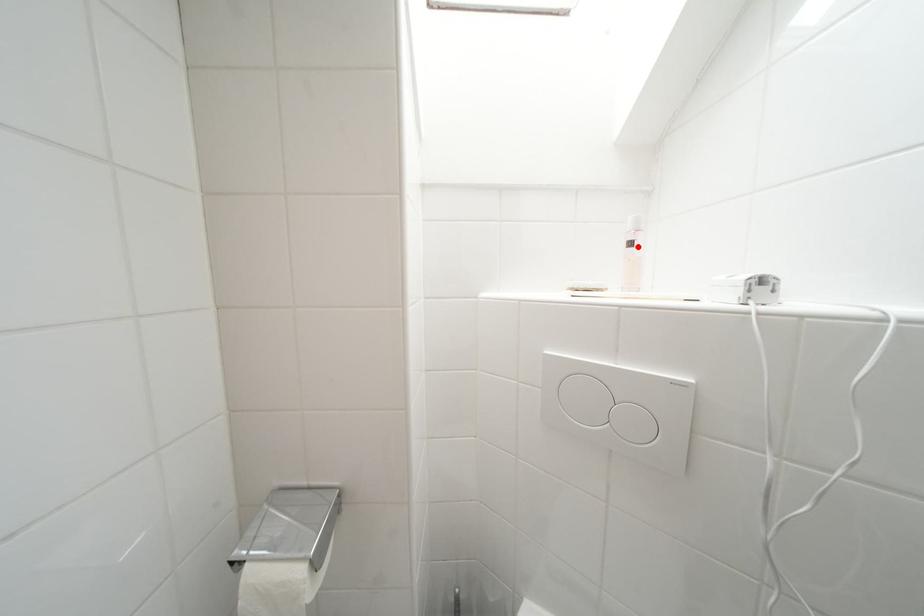
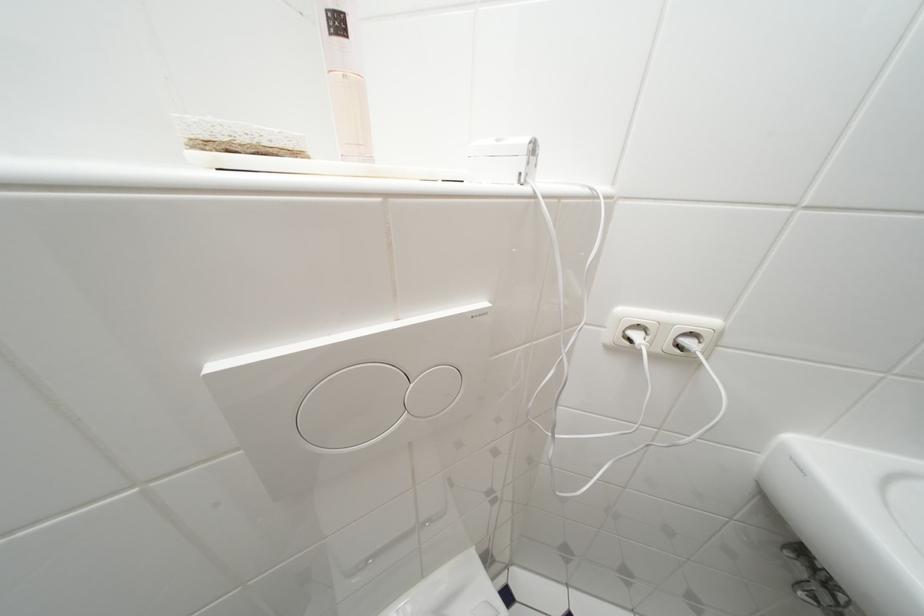
Find the pixel in the second image that matches the highlighted location in the first image.

(345, 26)